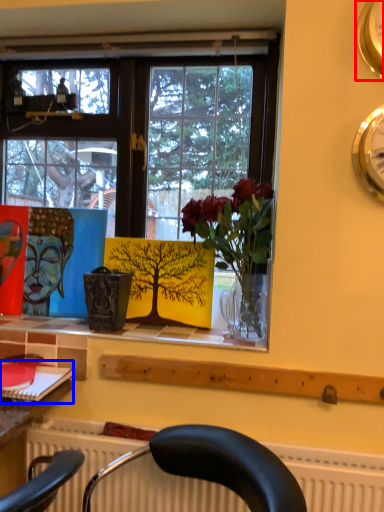
Question: Which point is further to the camera, clock (highlighted by a red box) or book (highlighted by a blue box)?

Choices:
 (A) clock
 (B) book

Answer: (B)